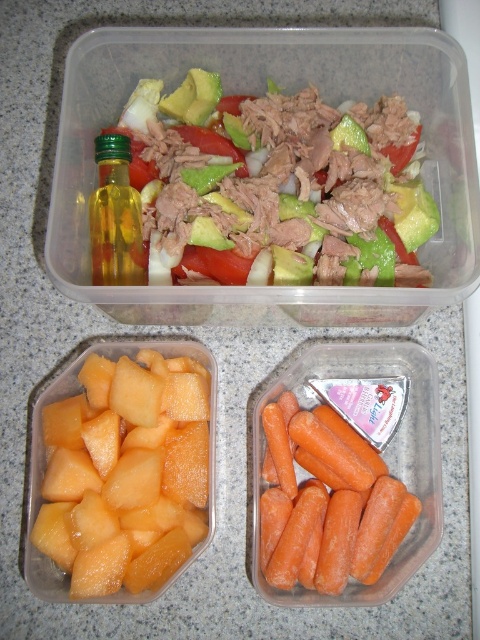
You are a chef preparing a meal and need to place the orange smooth carrot at lower right and the green glass bottle at upper left on a shelf. If the shelf has limited width, which item might require more space horizontally?

The orange smooth carrot at lower right might be wider than the green glass bottle at upper left, so it might require more horizontal space.

You are a drone operator trying to capture a closeup of the shiny green avocado at upper center. Your drone is currently positioned 30 inches away from the avocado. The drone can move forward or backward. Do you need to adjust the drone position to get a closer shot?

The distance between the shiny green avocado at upper center and the camera is 31.78 inches. Since the drone is currently at 30 inches, it is already closer than the required distance. To get a closer shot, you would need to move the drone forward to reduce the distance below 31.78 inches. However, the given information specifies the current distance as 31.78 inches, so if the drone is at 30 inches, it is already closer. Therefore, no adjustment is needed for a closer shot.